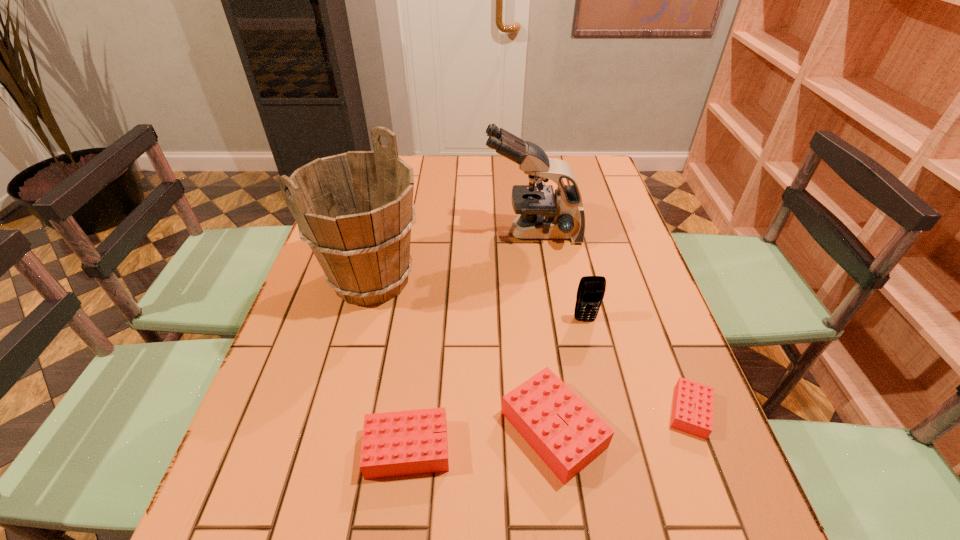
The image size is (960, 540). In the image, there is a desktop. Find the location of `free region at the far edge`. free region at the far edge is located at coordinates point(510,178).

The width and height of the screenshot is (960, 540). Identify the location of free spot at the left edge of the desktop. (343, 340).

Identify the location of vacant area at the right edge of the desktop. Image resolution: width=960 pixels, height=540 pixels. (638, 262).

Find the location of a particular element. vacant space at the far right corner is located at coordinates (573, 161).

At what (x,y) coordinates should I click in order to perform the action: click on vacant region between the second Lego from right to left and the bucket. Please return your answer as a coordinate pair (x, y). The width and height of the screenshot is (960, 540). Looking at the image, I should click on (463, 355).

This screenshot has height=540, width=960. I want to click on vacant area that lies between the bucket and the shortest Lego, so click(x=531, y=346).

The image size is (960, 540). I want to click on vacant region between the second Lego from left to right and the bucket, so click(463, 355).

The image size is (960, 540). In order to click on unoccupied position between the second shortest object and the microscope in this screenshot , I will do click(x=470, y=341).

Locate an element on the screen. The width and height of the screenshot is (960, 540). vacant point located between the leftmost Lego and the microscope is located at coordinates (470, 341).

Where is `vacant region between the cellular telephone and the microscope`? vacant region between the cellular telephone and the microscope is located at coordinates (559, 276).